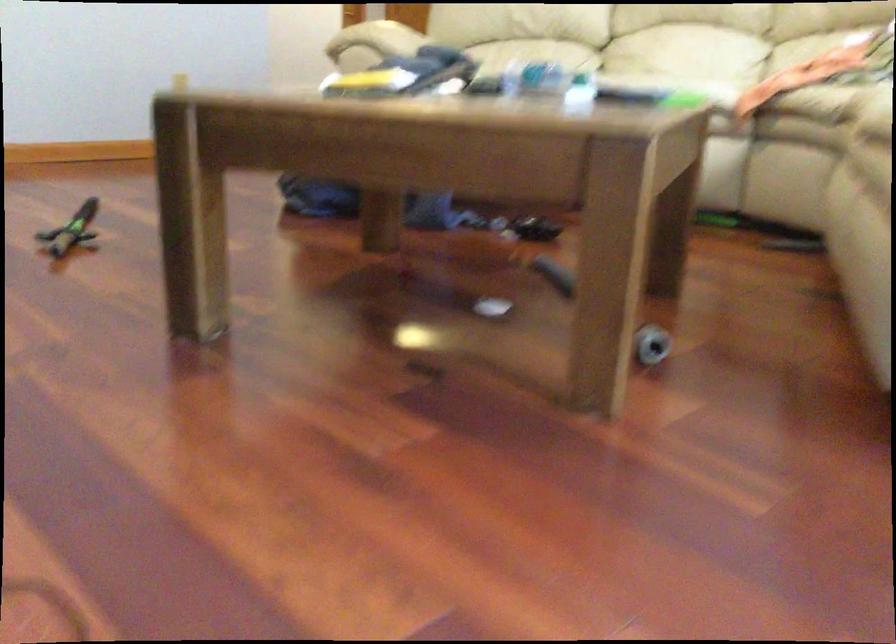
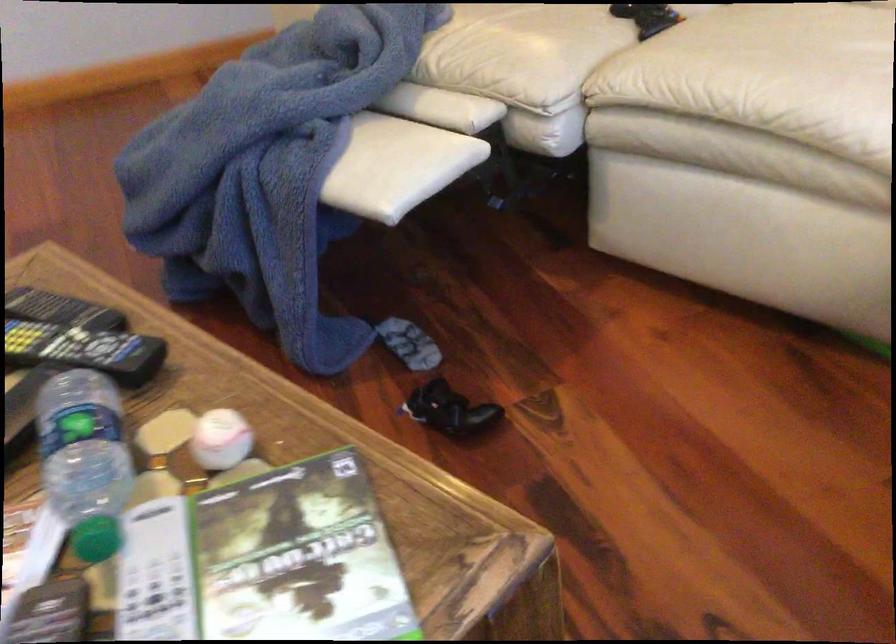
The point at [485,79] is marked in the first image. Where is the corresponding point in the second image?

(84, 350)